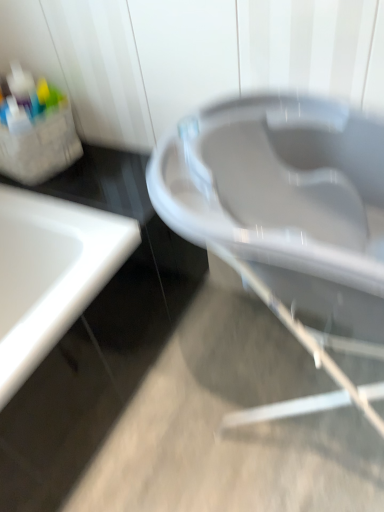
Question: Is white glossy sink at left behind white plastic bath at center?

Choices:
 (A) yes
 (B) no

Answer: (A)

Question: From a real-world perspective, is white glossy sink at left located higher than white plastic bath at center?

Choices:
 (A) yes
 (B) no

Answer: (B)

Question: Is white glossy sink at left at the right side of white plastic bath at center?

Choices:
 (A) no
 (B) yes

Answer: (A)

Question: From the image's perspective, does white glossy sink at left appear lower than white plastic bath at center?

Choices:
 (A) no
 (B) yes

Answer: (B)

Question: From the image's perspective, is white glossy sink at left over white plastic bath at center?

Choices:
 (A) yes
 (B) no

Answer: (B)

Question: Considering the relative sizes of white glossy sink at left and white plastic bath at center in the image provided, is white glossy sink at left bigger than white plastic bath at center?

Choices:
 (A) no
 (B) yes

Answer: (B)

Question: Can you confirm if white plastic bath at center is thinner than white glossy sink at left?

Choices:
 (A) no
 (B) yes

Answer: (B)

Question: Considering the relative sizes of white plastic bath at center and white glossy sink at left in the image provided, is white plastic bath at center smaller than white glossy sink at left?

Choices:
 (A) no
 (B) yes

Answer: (B)

Question: Does white plastic bath at center have a larger size compared to white glossy sink at left?

Choices:
 (A) yes
 (B) no

Answer: (B)

Question: Does white plastic bath at center lie behind white glossy sink at left?

Choices:
 (A) yes
 (B) no

Answer: (B)

Question: Is white glossy sink at left a part of white plastic bath at center?

Choices:
 (A) no
 (B) yes

Answer: (A)

Question: From a real-world perspective, is white plastic bath at center physically above white glossy sink at left?

Choices:
 (A) yes
 (B) no

Answer: (A)

Question: From a real-world perspective, is white plastic bath at center above or below white glossy sink at left?

Choices:
 (A) above
 (B) below

Answer: (A)